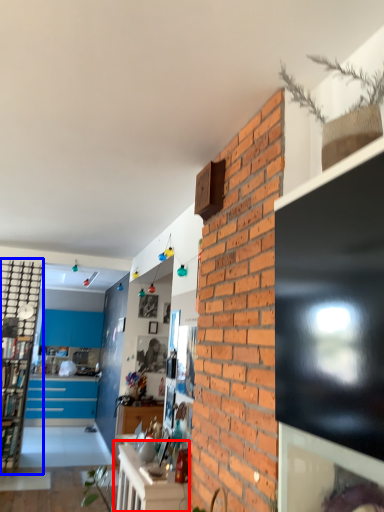
Question: Which point is further to the camera, table (highlighted by a red box) or cabinetry (highlighted by a blue box)?

Choices:
 (A) table
 (B) cabinetry

Answer: (B)